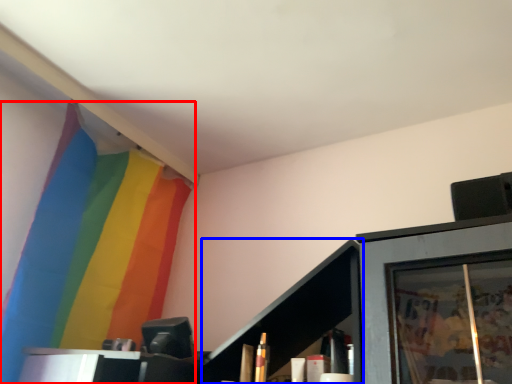
Question: Which object appears closest to the camera in this image, curtain (highlighted by a red box) or cabinet (highlighted by a blue box)?

Choices:
 (A) curtain
 (B) cabinet

Answer: (B)